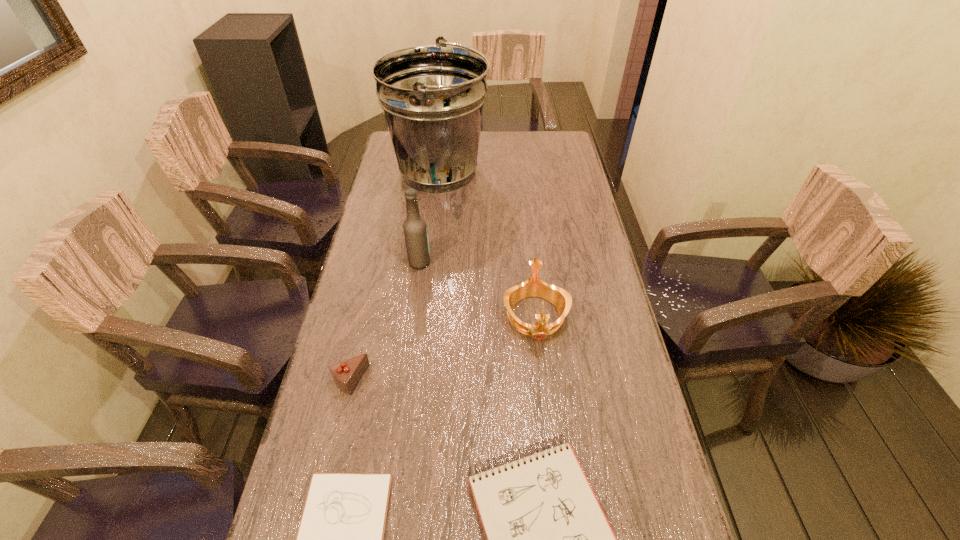
Where is `the farthest object`? the farthest object is located at coordinates (432, 97).

Locate an element on the screen. bucket is located at coordinates (432, 97).

The image size is (960, 540). I want to click on beer bottle, so click(415, 229).

Identify the location of the fifth shortest object. The height and width of the screenshot is (540, 960). (415, 229).

The image size is (960, 540). I want to click on the fourth shortest object, so click(533, 287).

Locate an element on the screen. the fourth nearest object is located at coordinates (533, 287).

This screenshot has width=960, height=540. What are the coordinates of `chocolate cake` in the screenshot? It's located at (346, 374).

Locate an element on the screen. Image resolution: width=960 pixels, height=540 pixels. the third nearest object is located at coordinates (346, 374).

Image resolution: width=960 pixels, height=540 pixels. What are the coordinates of `vacant area situated 0.090m on the back of the farthest object` in the screenshot? It's located at (444, 133).

Locate an element on the screen. free space located on the side of the second tallest object with the label is located at coordinates (555, 262).